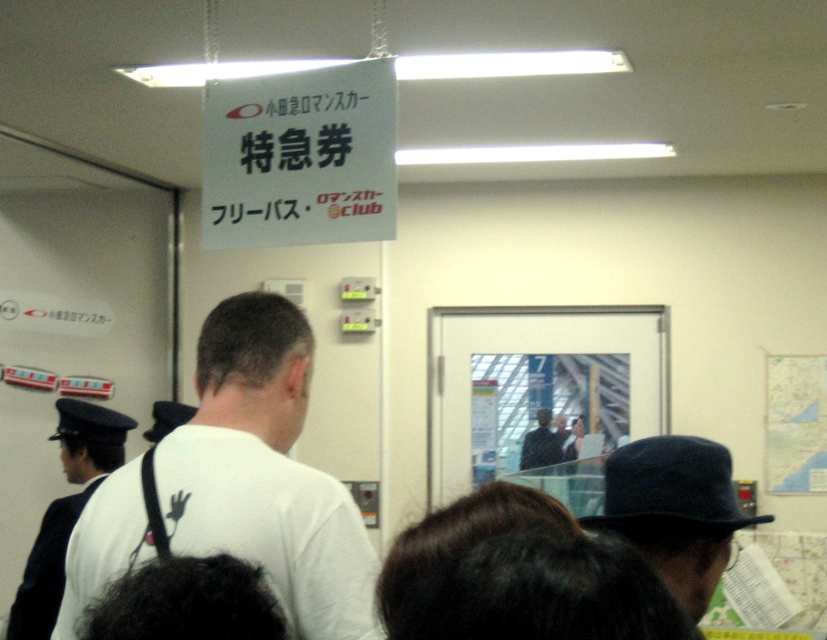
Question: Is dark blue felt hat at center bigger than map paper at upper right?

Choices:
 (A) yes
 (B) no

Answer: (A)

Question: Is white t-shirt at center smaller than map paper at upper right?

Choices:
 (A) yes
 (B) no

Answer: (B)

Question: Which point is farther to the camera?

Choices:
 (A) (558, 458)
 (B) (225, 497)
 (C) (82, 468)

Answer: (A)

Question: Can you confirm if map paper at upper right is wider than dark blue hat at center?

Choices:
 (A) yes
 (B) no

Answer: (A)

Question: Which object is the closest to the map paper at upper right?

Choices:
 (A) white paper sign at upper center
 (B) dark blue hat at center

Answer: (B)

Question: Among these points, which one is farthest from the camera?

Choices:
 (A) (131, 490)
 (B) (662, 460)
 (C) (46, 609)
 (D) (802, 432)

Answer: (D)